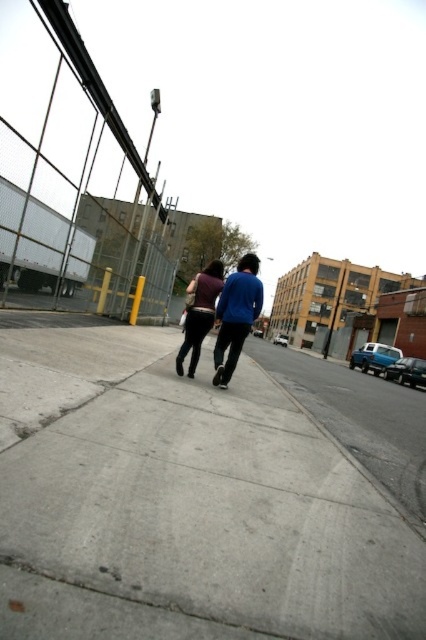
You are a delivery person standing on the gray concrete sidewalk at center and need to hand a package to the person wearing the matte blue jacket at center. Can you easily reach them while staying on the sidewalk?

The gray concrete sidewalk at center is not as tall as matte blue jacket at center, meaning the sidewalk is lower than the jacket wearer. Since the sidewalk is lower, you can easily reach them without needing to step off the sidewalk.

From the picture: Where is the matte blue jacket at center located in the scene?

The matte blue jacket at center is located at point (236, 316) in the scene.

You are a delivery person trying to walk on the gray concrete sidewalk at center while carrying a large box. Can you fit the matte blue jacket at center on the sidewalk with you without stepping off?

The gray concrete sidewalk at center is wider than the matte blue jacket at center, so yes, you can fit both yourself and the matte blue jacket at center on the sidewalk without needing to step off.